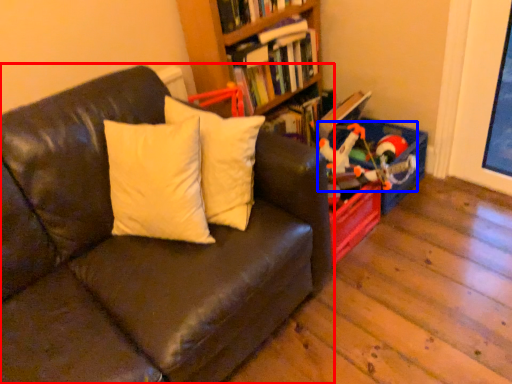
Question: Which of the following is the farthest to the observer, studio couch (highlighted by a red box) or toy (highlighted by a blue box)?

Choices:
 (A) studio couch
 (B) toy

Answer: (B)